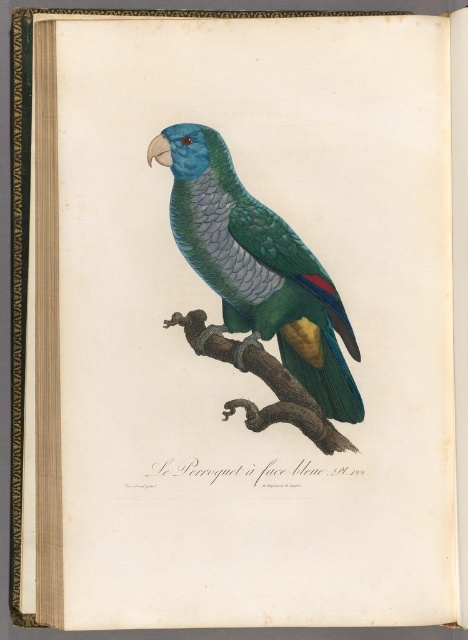
Looking at this image, you are an ornithologist examining the illustration of the parrot. You notice a specific point at coordinates point (256, 268). Based on the scene, where exactly is this point located on the parrot?

The point (256, 268) is on the shiny green parrot at center.

You are an ornithologist observing the parrot and the tree branch in the image. Based on their sizes, can you determine if the shiny green parrot at center could potentially block the view of the brown rough tree branch at center when looking from the front?

The shiny green parrot at center might be wider than brown rough tree branch at center, so it could potentially block the view of the brown rough tree branch at center when viewed from the front.

You are a photographer holding a camera and want to take a closeup shot of the shiny green parrot at center. The camera requires the subject to be at least 1.5 meters away to focus properly. Based on the illustration, will the parrot be in focus?

The shiny green parrot at center is 1.28 meters away from camera, which is closer than the required 1.5 meters. Therefore, the parrot will not be in focus.